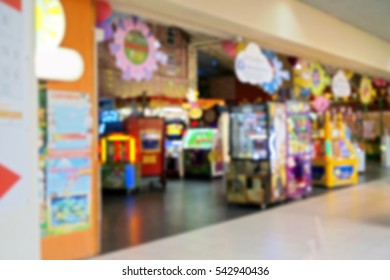
I want to click on poster, so click(74, 139), click(80, 194), click(15, 154).